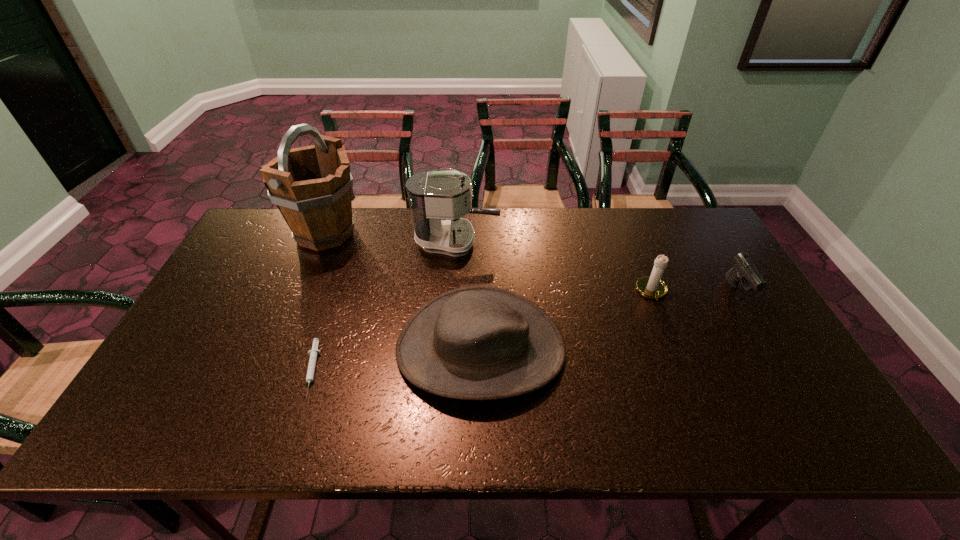
What are the coordinates of `vacant region located 0.290m on the left of the cowboy hat` in the screenshot? It's located at (282, 348).

The image size is (960, 540). I want to click on vacant space located at the barrel of the rightmost object, so click(760, 329).

At what (x,y) coordinates should I click in order to perform the action: click on vacant area situated 0.050m on the left of the shortest object. Please return your answer as a coordinate pair (x, y). Looking at the image, I should click on (283, 369).

Find the location of `bucket that is positioned at the far edge`. bucket that is positioned at the far edge is located at coordinates (311, 186).

You are a GUI agent. You are given a task and a screenshot of the screen. Output one action in this format:
    pyautogui.click(x=<x>, y=<y>)
    Task: Click on the coffee maker positioned at the far edge
    This screenshot has width=960, height=540.
    Given the screenshot: What is the action you would take?
    pyautogui.click(x=438, y=199)

Identify the location of object that is at the near edge. Image resolution: width=960 pixels, height=540 pixels. (478, 342).

Where is `object that is positioned at the left edge`? This screenshot has height=540, width=960. object that is positioned at the left edge is located at coordinates tap(311, 186).

Where is `object positioned at the right edge`? object positioned at the right edge is located at coordinates (744, 271).

Locate an element on the screen. The height and width of the screenshot is (540, 960). object situated at the far left corner is located at coordinates (311, 186).

At what (x,y) coordinates should I click in order to perform the action: click on free space at the far edge of the desktop. Please return your answer as a coordinate pair (x, y). Looking at the image, I should click on (390, 241).